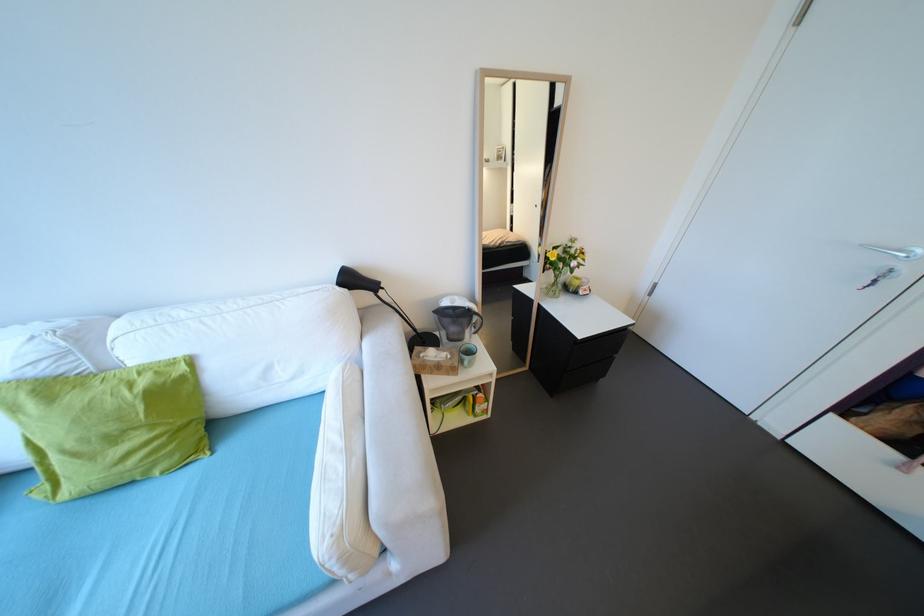
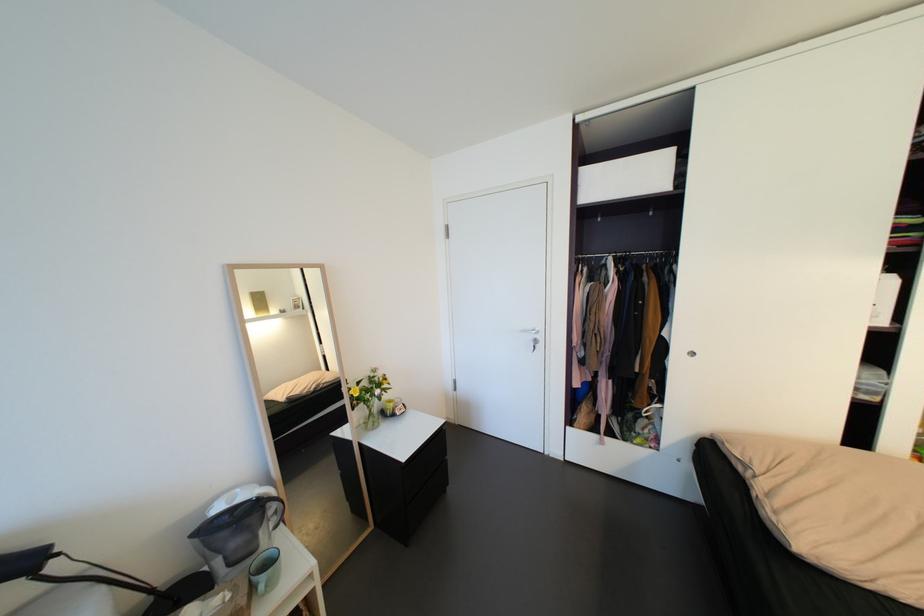
Locate, in the second image, the point that corresponds to (587,338) in the first image.

(410, 460)